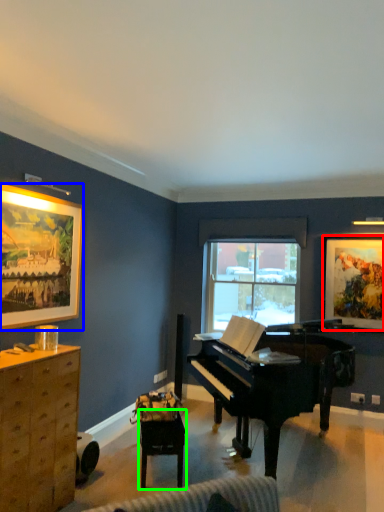
Question: Which object is the farthest from picture frame (highlighted by a red box)? Choose among these: picture frame (highlighted by a blue box) or table (highlighted by a green box).

Choices:
 (A) picture frame
 (B) table

Answer: (A)